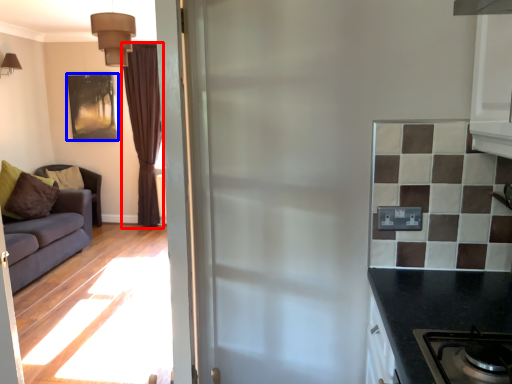
Question: Which of the following is the closest to the observer, curtain (highlighted by a red box) or picture frame (highlighted by a blue box)?

Choices:
 (A) curtain
 (B) picture frame

Answer: (A)